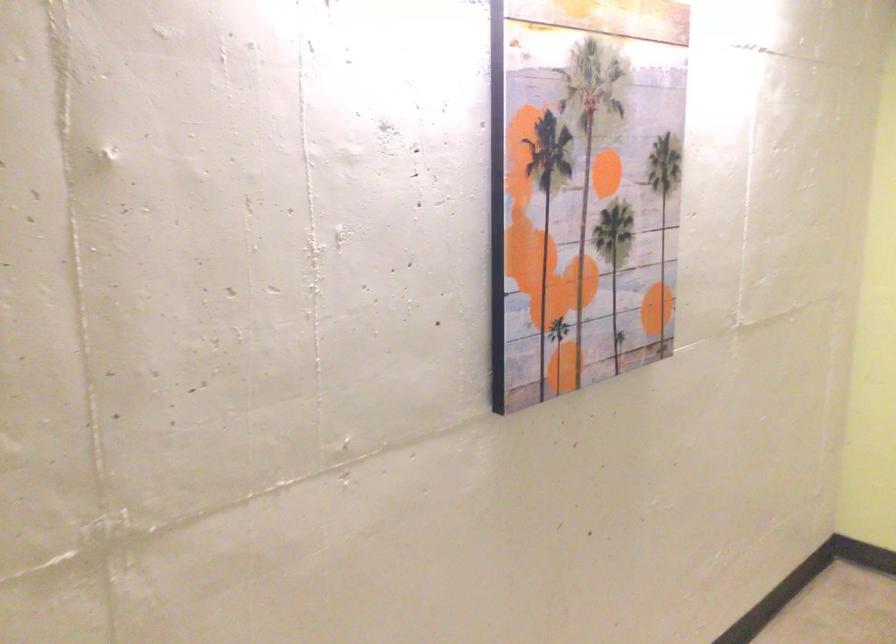
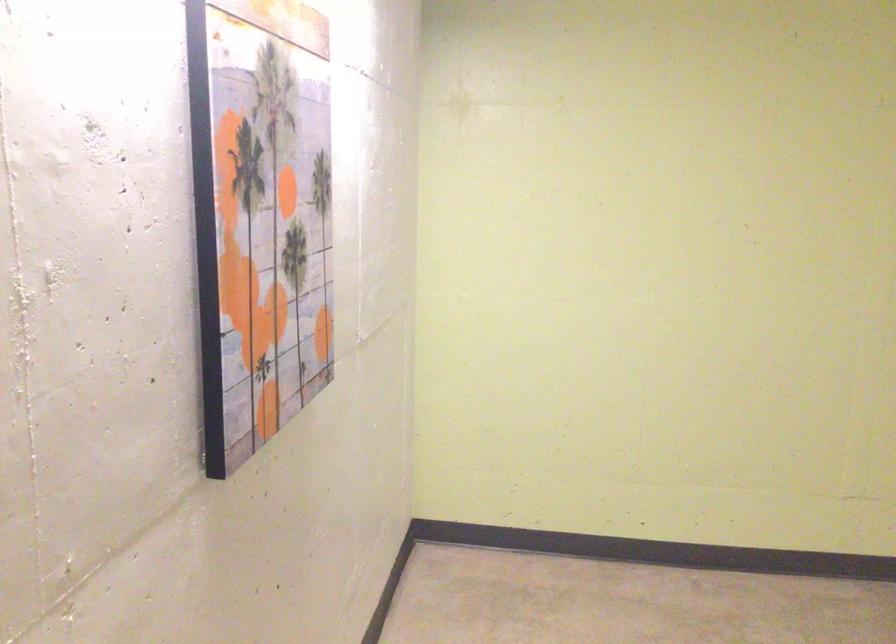
Question: How did the camera likely rotate?

Choices:
 (A) Left
 (B) Right
 (C) Up
 (D) Down

Answer: (B)